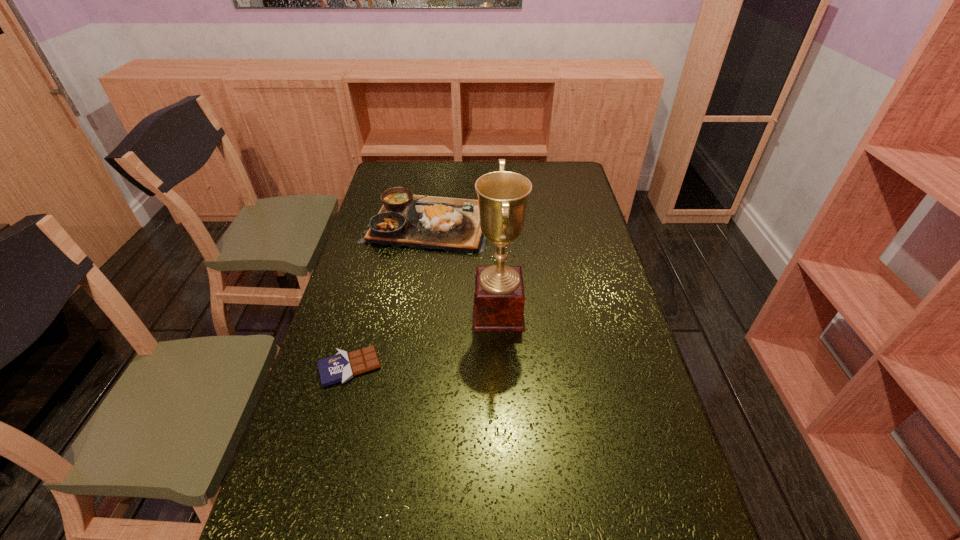
You are a GUI agent. You are given a task and a screenshot of the screen. Output one action in this format:
    pyautogui.click(x=<x>, y=<y>)
    Task: Click on the blank region between the shortest object and the tallest object
    
    Given the screenshot: What is the action you would take?
    pyautogui.click(x=424, y=340)

The width and height of the screenshot is (960, 540). What are the coordinates of `blank region between the chocolate bar and the tallest object` in the screenshot? It's located at (424, 340).

The image size is (960, 540). I want to click on free area in between the nearest object and the trophy cup, so click(424, 340).

Locate which object is the closest to the chocolate bar. Please provide its 2D coordinates. Your answer should be formatted as a tuple, i.e. [(x, y)], where the tuple contains the x and y coordinates of a point satisfying the conditions above.

[(499, 298)]

In order to click on object that is the closest one to the platter in this screenshot , I will do `click(499, 298)`.